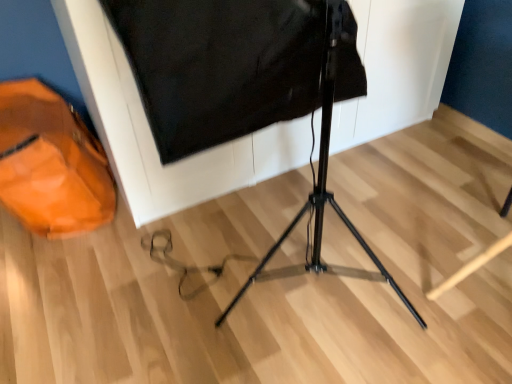
Image resolution: width=512 pixels, height=384 pixels. Describe the element at coordinates (51, 163) in the screenshot. I see `orange leather tote at lower left` at that location.

Locate an element on the screen. This screenshot has width=512, height=384. orange leather tote at lower left is located at coordinates (51, 163).

What is the approximate height of orange leather tote at lower left?

orange leather tote at lower left is 17.22 inches tall.

Image resolution: width=512 pixels, height=384 pixels. I want to click on orange leather tote at lower left, so click(51, 163).